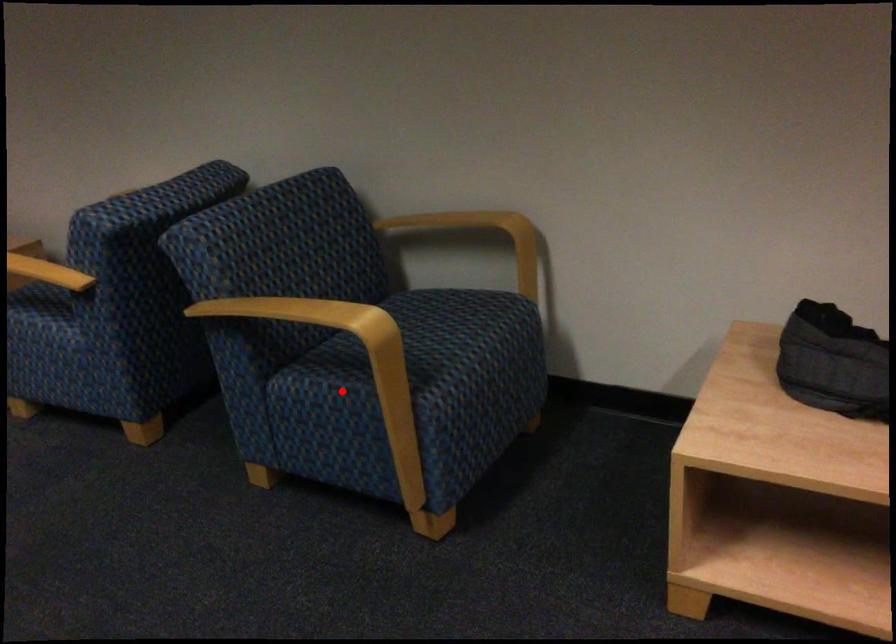
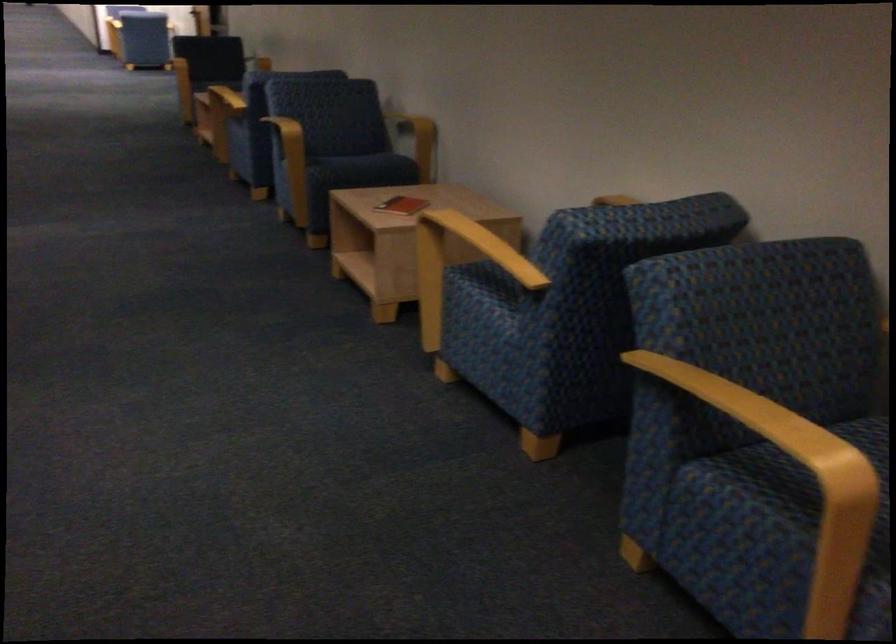
Question: I am providing you with two images of the same scene from different viewpoints. In image1, a red point is highlighted. Considering the same 3D point in image2, which of the following is correct?

Choices:
 (A) It is closer
 (B) It is farther

Answer: (A)